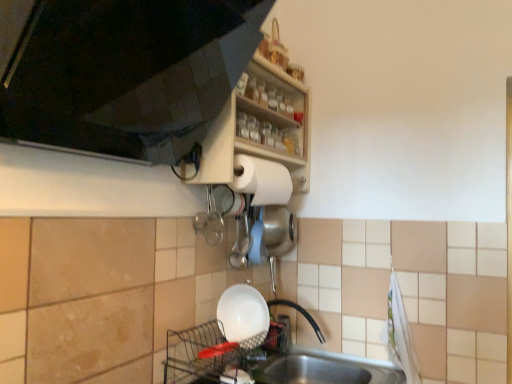
Question: Can we say wooden shelf at upper center lies outside matte wood shelf at upper center?

Choices:
 (A) yes
 (B) no

Answer: (A)

Question: Is wooden shelf at upper center directly adjacent to matte wood shelf at upper center?

Choices:
 (A) yes
 (B) no

Answer: (B)

Question: Is wooden shelf at upper center closer to the viewer compared to matte wood shelf at upper center?

Choices:
 (A) no
 (B) yes

Answer: (A)

Question: Is wooden shelf at upper center smaller than matte wood shelf at upper center?

Choices:
 (A) yes
 (B) no

Answer: (A)

Question: Is wooden shelf at upper center positioned with its back to matte wood shelf at upper center?

Choices:
 (A) yes
 (B) no

Answer: (B)

Question: Is wooden shelf at upper center aimed at matte wood shelf at upper center?

Choices:
 (A) yes
 (B) no

Answer: (B)

Question: Considering the relative positions of white glossy bowl at lower center and white matte paper towel at upper center in the image provided, is white glossy bowl at lower center to the left of white matte paper towel at upper center from the viewer's perspective?

Choices:
 (A) yes
 (B) no

Answer: (A)

Question: Is white glossy bowl at lower center shorter than white matte paper towel at upper center?

Choices:
 (A) yes
 (B) no

Answer: (A)

Question: Is white matte paper towel at upper center completely or partially inside white glossy bowl at lower center?

Choices:
 (A) yes
 (B) no

Answer: (B)

Question: From a real-world perspective, is white glossy bowl at lower center over white matte paper towel at upper center?

Choices:
 (A) yes
 (B) no

Answer: (B)

Question: From the image's perspective, is white glossy bowl at lower center under white matte paper towel at upper center?

Choices:
 (A) yes
 (B) no

Answer: (A)

Question: Could you tell me if white glossy bowl at lower center is facing white matte paper towel at upper center?

Choices:
 (A) no
 (B) yes

Answer: (A)

Question: Is white matte paper towel at upper center oriented away from wooden shelf at upper center?

Choices:
 (A) no
 (B) yes

Answer: (B)